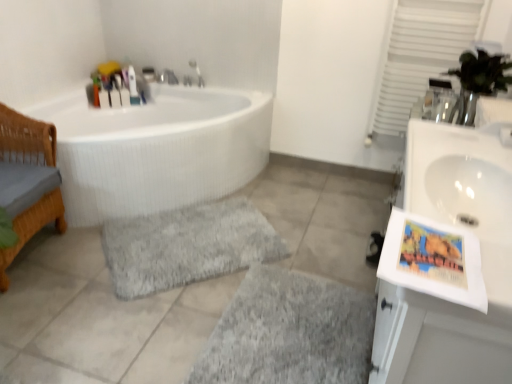
Question: Does matte plastic toothbrush at upper left, which is counted as the 4th toiletry, starting from the left, have a larger size compared to gray shaggy bath mat at center, the first bath mat positioned from the top?

Choices:
 (A) no
 (B) yes

Answer: (A)

Question: Could gray shaggy bath mat at center, the first bath mat positioned from the top, be considered to be inside matte plastic toothbrush at upper left, the first toiletry positioned from the right?

Choices:
 (A) no
 (B) yes

Answer: (A)

Question: Can you confirm if matte plastic toothbrush at upper left, which is counted as the 4th toiletry, starting from the left, is wider than gray shaggy bath mat at center, the first bath mat positioned from the top?

Choices:
 (A) no
 (B) yes

Answer: (A)

Question: Is matte plastic toothbrush at upper left, which is counted as the 4th toiletry, starting from the left, oriented towards gray shaggy bath mat at center, positioned as the second bath mat in bottom-to-top order?

Choices:
 (A) no
 (B) yes

Answer: (B)

Question: Does matte plastic toothbrush at upper left, which is counted as the 4th toiletry, starting from the left, lie behind gray shaggy bath mat at center, the first bath mat positioned from the top?

Choices:
 (A) no
 (B) yes

Answer: (B)

Question: From a real-world perspective, relative to translucent plastic bottles at upper left, which is the 4th toiletry from right to left, is translucent plastic container at upper left, acting as the second toiletry starting from the right, vertically above or below?

Choices:
 (A) above
 (B) below

Answer: (B)

Question: Based on their sizes in the image, would you say translucent plastic container at upper left, acting as the second toiletry starting from the right, is bigger or smaller than translucent plastic bottles at upper left, which appears as the 1th toiletry when viewed from the left?

Choices:
 (A) small
 (B) big

Answer: (A)

Question: From the image's perspective, is translucent plastic container at upper left, which is the third toiletry in left-to-right order, located above or below translucent plastic bottles at upper left, which is the 4th toiletry from right to left?

Choices:
 (A) below
 (B) above

Answer: (B)

Question: Considering the positions of translucent plastic container at upper left, which is the third toiletry in left-to-right order, and translucent plastic bottles at upper left, which is the 4th toiletry from right to left, in the image, is translucent plastic container at upper left, which is the third toiletry in left-to-right order, wider or thinner than translucent plastic bottles at upper left, which is the 4th toiletry from right to left,?

Choices:
 (A) thin
 (B) wide

Answer: (A)

Question: Considering the positions of gray shaggy rug at center, arranged as the first bath mat when ordered from the bottom, and gray shaggy bath mat at center, positioned as the second bath mat in bottom-to-top order, in the image, is gray shaggy rug at center, arranged as the first bath mat when ordered from the bottom, taller or shorter than gray shaggy bath mat at center, positioned as the second bath mat in bottom-to-top order,?

Choices:
 (A) tall
 (B) short

Answer: (B)

Question: Based on their sizes in the image, would you say gray shaggy rug at center, which is counted as the second bath mat, starting from the top, is bigger or smaller than gray shaggy bath mat at center, positioned as the second bath mat in bottom-to-top order?

Choices:
 (A) small
 (B) big

Answer: (A)

Question: In the image, is gray shaggy rug at center, which is counted as the second bath mat, starting from the top, positioned in front of or behind gray shaggy bath mat at center, the first bath mat positioned from the top?

Choices:
 (A) front
 (B) behind

Answer: (A)

Question: Is point (228, 342) closer or farther from the camera than point (137, 218)?

Choices:
 (A) farther
 (B) closer

Answer: (B)

Question: From the image's perspective, relative to woven wood basket at left, is white glossy bathtub at left above or below?

Choices:
 (A) below
 (B) above

Answer: (B)

Question: Considering the relative positions of white glossy bathtub at left and woven wood basket at left in the image provided, is white glossy bathtub at left to the left or to the right of woven wood basket at left?

Choices:
 (A) right
 (B) left

Answer: (A)